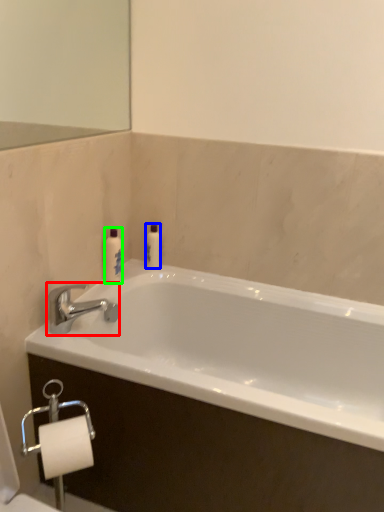
Question: Estimate the real-world distances between objects in this image. Which object is farther from tap (highlighted by a red box), toiletry (highlighted by a blue box) or toiletry (highlighted by a green box)?

Choices:
 (A) toiletry
 (B) toiletry

Answer: (A)